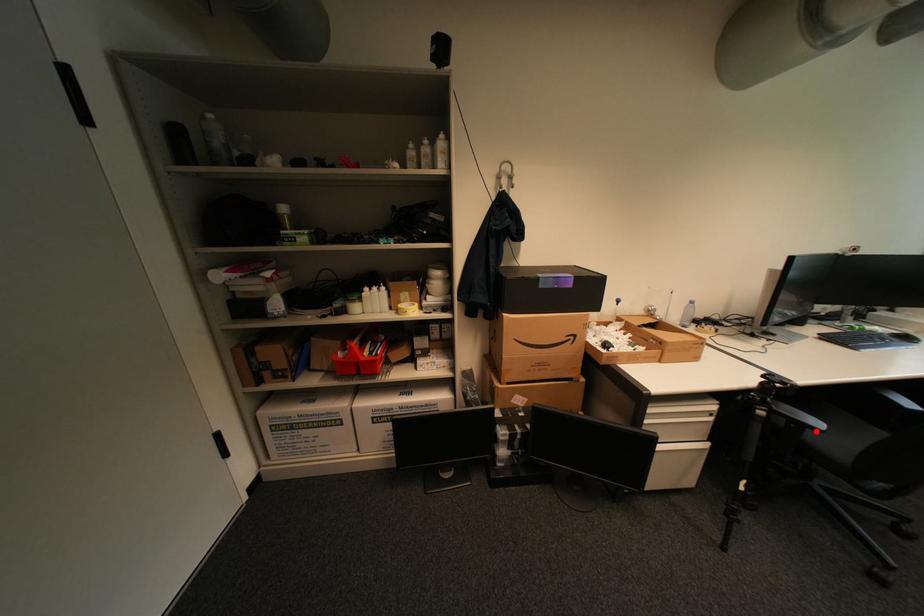
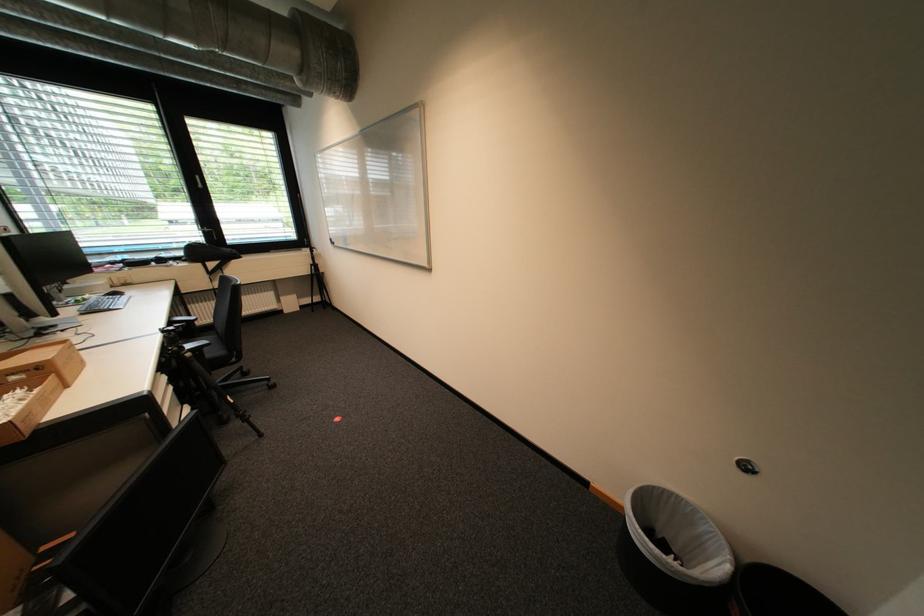
Find the pixel in the second image that matches the highlighted location in the first image.

(213, 350)